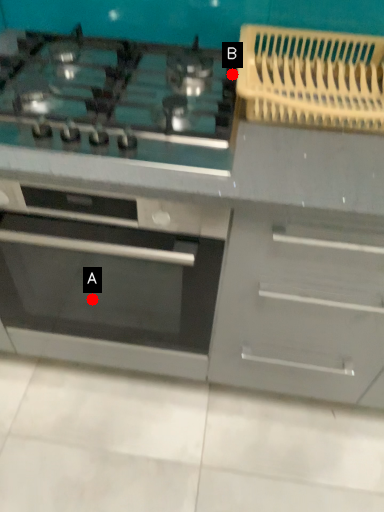
Question: Two points are circled on the image, labeled by A and B beside each circle. Among these points, which one is farthest from the camera?

Choices:
 (A) A is further
 (B) B is further

Answer: (A)